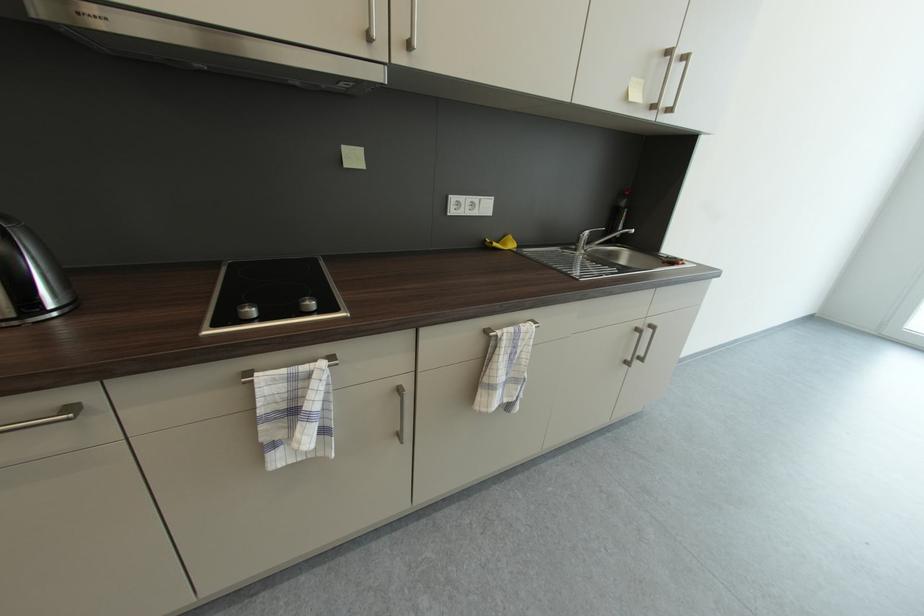
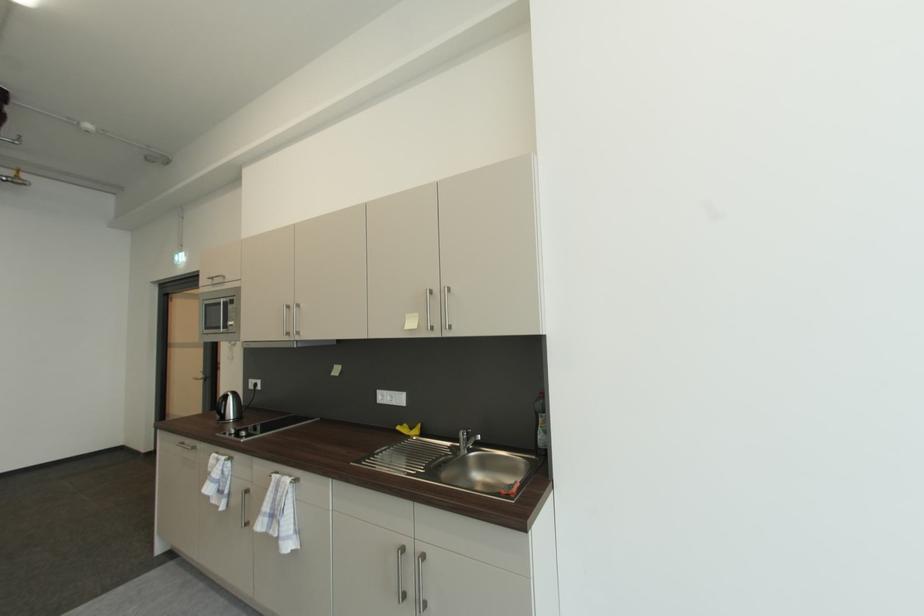
Find the pixel in the second image that matches point (492, 243) in the first image.

(408, 427)